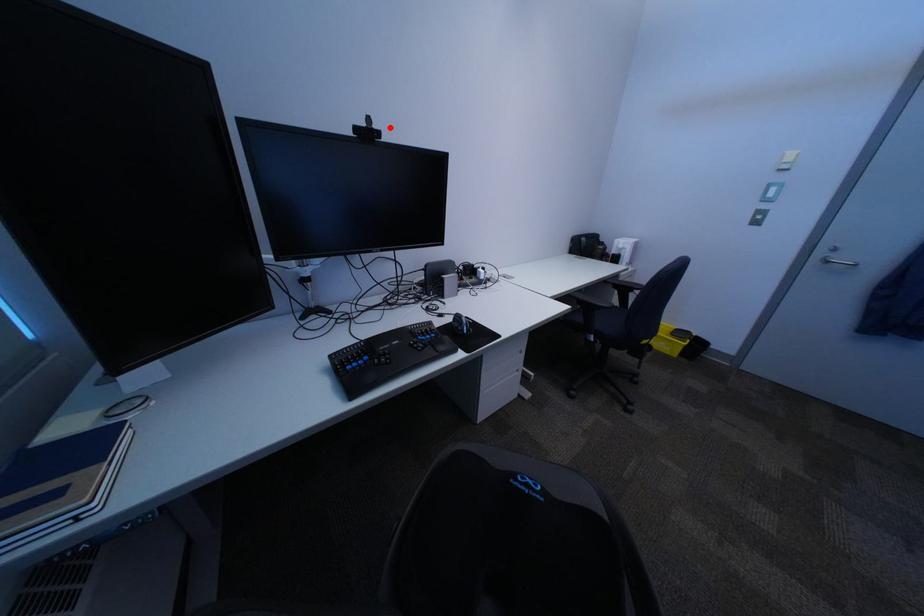
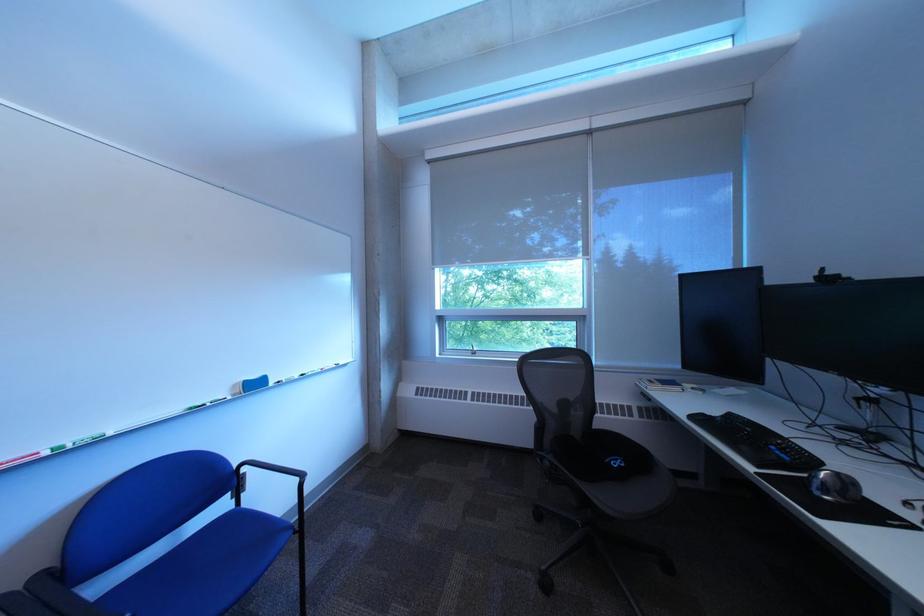
Find the pixel in the second image that matches the highlighted location in the first image.

(843, 275)